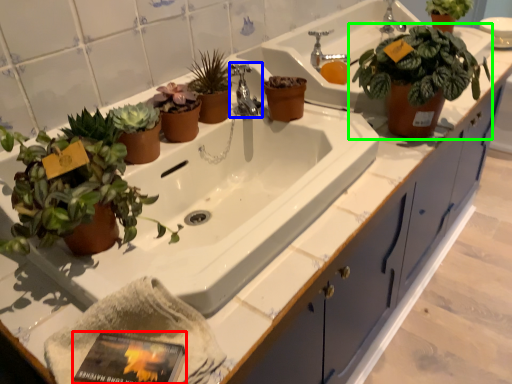
Question: Which object is positioned farthest from paperback book (highlighted by a red box)? Select from tap (highlighted by a blue box) and houseplant (highlighted by a green box).

Choices:
 (A) tap
 (B) houseplant

Answer: (B)